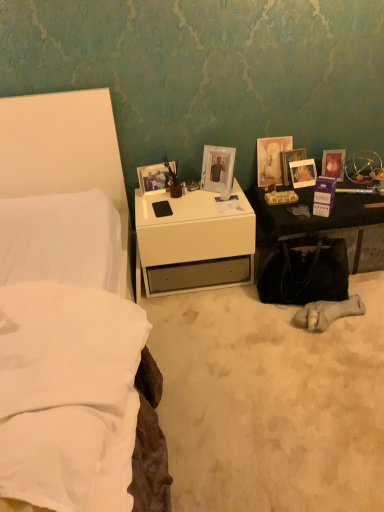
In order to click on free space to the left of black leather handbag at lower right in this screenshot , I will do `click(239, 313)`.